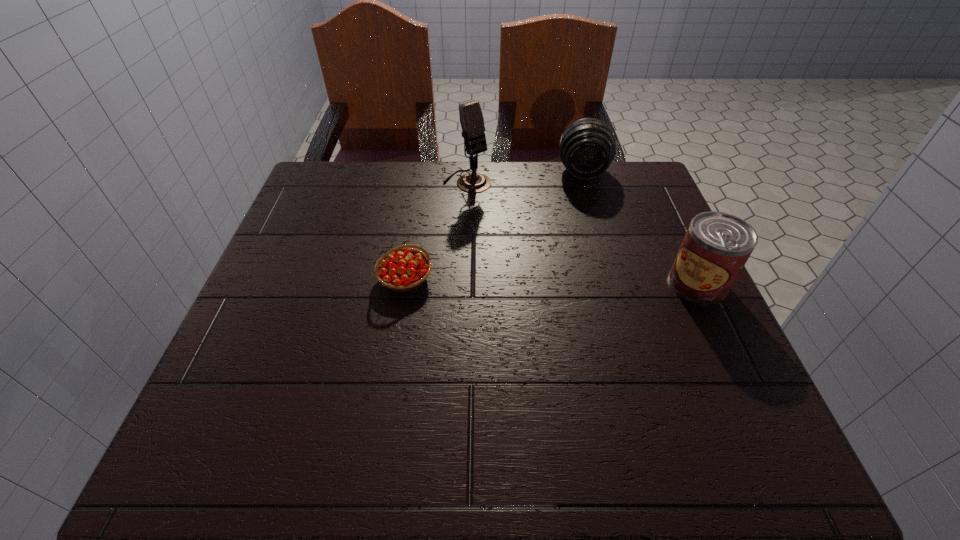
Locate an element on the screen. the shortest object is located at coordinates (401, 269).

You are a GUI agent. You are given a task and a screenshot of the screen. Output one action in this format:
    pyautogui.click(x=<x>, y=<y>)
    Task: Click on the leftmost object
    This screenshot has height=540, width=960.
    Given the screenshot: What is the action you would take?
    pyautogui.click(x=401, y=269)

Find the location of a particular element. The width and height of the screenshot is (960, 540). the rightmost object is located at coordinates (717, 245).

At what (x,y) coordinates should I click in order to perform the action: click on the second object from left to right. Please return your answer as a coordinate pair (x, y). Image resolution: width=960 pixels, height=540 pixels. Looking at the image, I should click on click(x=471, y=118).

This screenshot has height=540, width=960. Find the location of `microphone`. microphone is located at coordinates (471, 118).

This screenshot has width=960, height=540. What are the coordinates of `telephoto lens` in the screenshot? It's located at point(587,147).

Where is `free space located 0.210m on the back of the leftmost object`? free space located 0.210m on the back of the leftmost object is located at coordinates (418, 202).

This screenshot has width=960, height=540. In order to click on vacant space located 0.290m on the back of the can in this screenshot , I will do `click(652, 187)`.

This screenshot has height=540, width=960. I want to click on free space located 0.220m on the front-facing side of the tallest object, so click(x=532, y=238).

Locate an element on the screen. This screenshot has height=540, width=960. free space located 0.180m on the front-facing side of the tallest object is located at coordinates (521, 228).